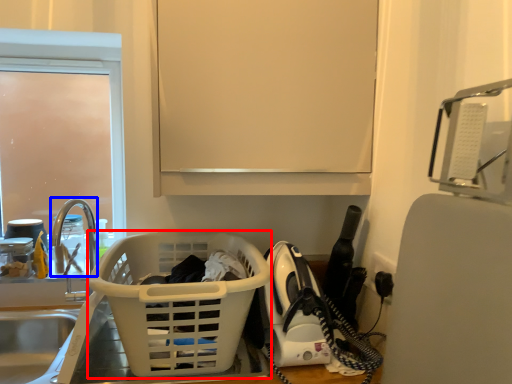
Question: Which of the following is the farthest to the observer, basket (highlighted by a red box) or faucet (highlighted by a blue box)?

Choices:
 (A) basket
 (B) faucet

Answer: (B)